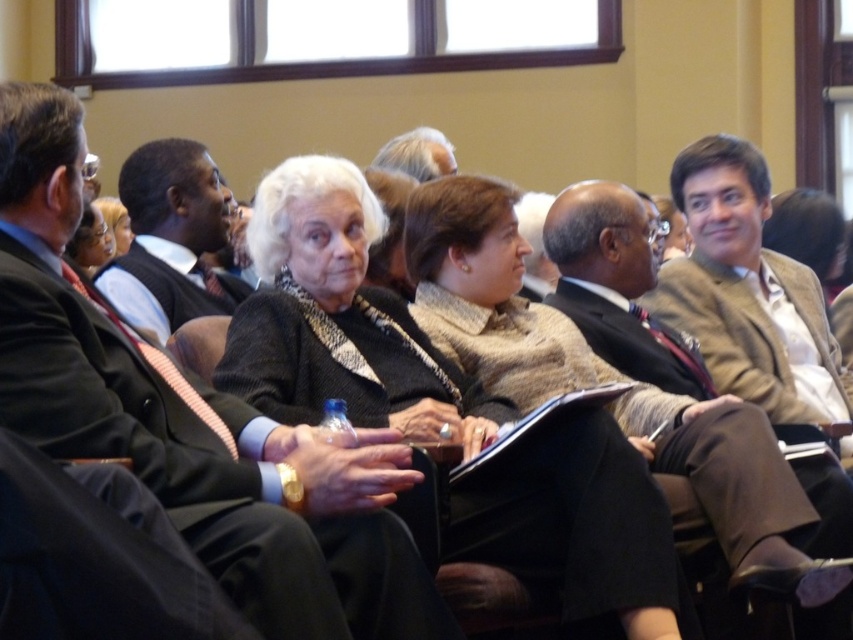
You are a photographer standing at the back of the room. You want to take a photo of the dark gray wool sweater at center and the brown textured suit at center in the same frame. The camera you are using has a maximum focus range of 6 meters. Will both subjects be in focus?

The dark gray wool sweater at center is 6.92 meters away from the brown textured suit at center. Since the photographer is at the back, the distance from the camera to the farther subject would exceed 6 meters, so not both will be in focus.

Where is the dark gray wool sweater at center located in the image?

The dark gray wool sweater at center is located at point (x=339, y=320).